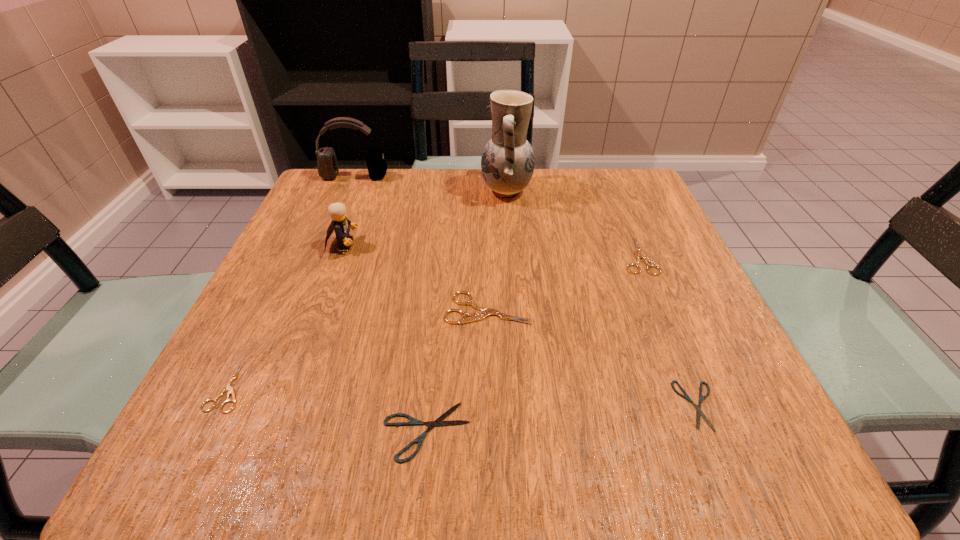
Image resolution: width=960 pixels, height=540 pixels. In order to click on the left black shears in this screenshot , I will do `click(438, 422)`.

Where is `the shortest shears`? the shortest shears is located at coordinates (698, 407).

Identify the location of the smaller black shears. (698, 407).

Where is `free space located 0.220m on either side of the pottery`? The image size is (960, 540). free space located 0.220m on either side of the pottery is located at coordinates (391, 191).

I want to click on free space located 0.110m on either side of the pottery, so click(x=436, y=191).

At what (x,y) coordinates should I click in order to perform the action: click on vacant space positioned 0.150m on either side of the pottery. Please return your answer as a coordinate pair (x, y). Looking at the image, I should click on (420, 191).

The height and width of the screenshot is (540, 960). I want to click on free space located 0.230m on the headband of the seventh shortest object, so click(x=329, y=237).

Locate an element on the screen. This screenshot has width=960, height=540. vacant region located 0.310m on the front-facing side of the third tallest object is located at coordinates [507, 244].

Identify the location of vacant space located 0.140m on the left of the biggest beige shears. The width and height of the screenshot is (960, 540). (366, 308).

The height and width of the screenshot is (540, 960). I want to click on free space located 0.240m on the back of the farthest beige shears, so click(x=606, y=180).